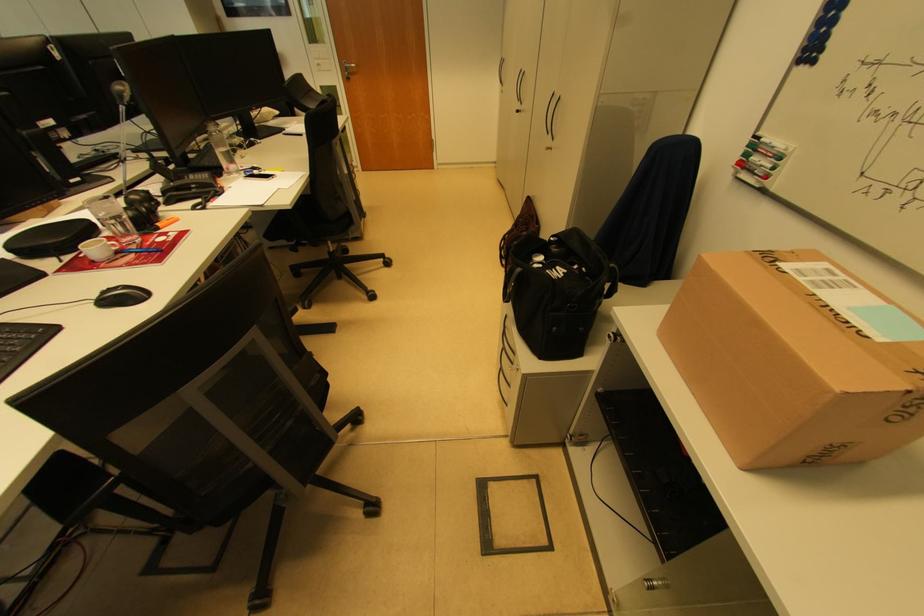
What do you see at coordinates (484, 516) in the screenshot? The width and height of the screenshot is (924, 616). I see `the floor panel handle` at bounding box center [484, 516].